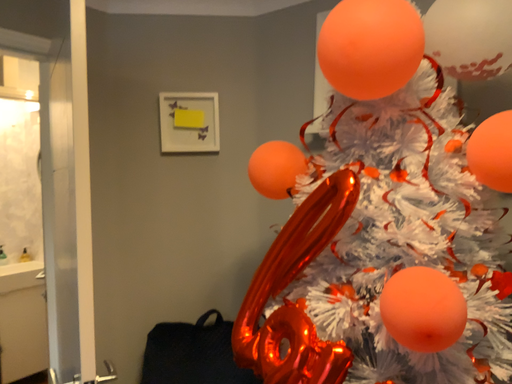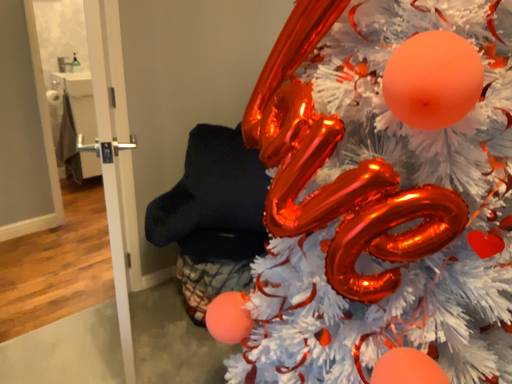
Question: Which way did the camera rotate in the video?

Choices:
 (A) rotated downward
 (B) rotated upward

Answer: (A)